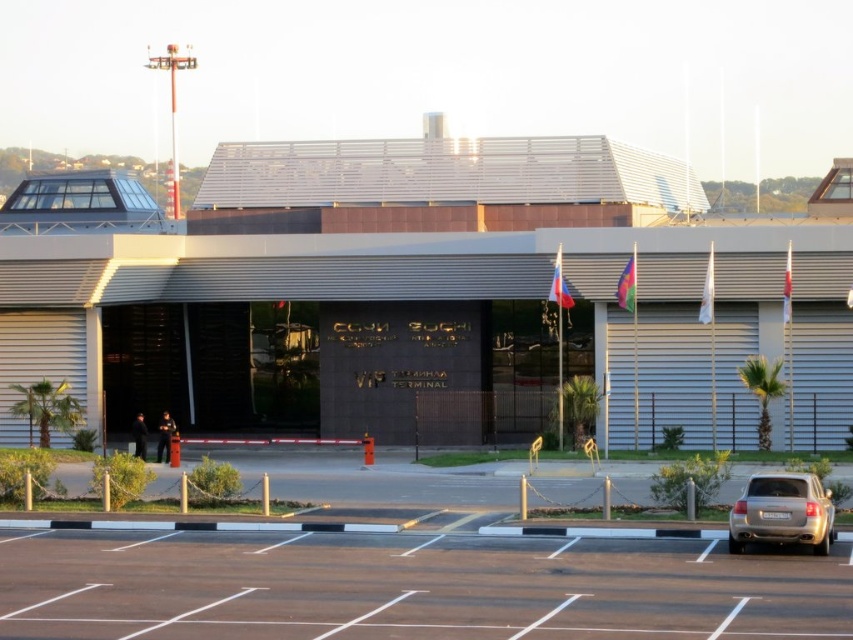
Which of these two, green leafy palm tree at left or green leafy palm tree at right, stands shorter?

Standing shorter between the two is green leafy palm tree at left.

Does green leafy palm tree at left have a lesser width compared to green leafy palm tree at right?

In fact, green leafy palm tree at left might be wider than green leafy palm tree at right.

What do you see at coordinates (47, 408) in the screenshot?
I see `green leafy palm tree at left` at bounding box center [47, 408].

You are a GUI agent. You are given a task and a screenshot of the screen. Output one action in this format:
    pyautogui.click(x=<x>, y=<y>)
    Task: Click on the green leafy palm tree at left
    The width and height of the screenshot is (853, 640).
    Given the screenshot: What is the action you would take?
    pyautogui.click(x=47, y=408)

Can you confirm if silver metallic sedan at lower right is positioned below green leafy palm tree at right?

Yes, silver metallic sedan at lower right is below green leafy palm tree at right.

This screenshot has width=853, height=640. What do you see at coordinates (782, 513) in the screenshot?
I see `silver metallic sedan at lower right` at bounding box center [782, 513].

This screenshot has width=853, height=640. What do you see at coordinates (782, 513) in the screenshot?
I see `silver metallic sedan at lower right` at bounding box center [782, 513].

The image size is (853, 640). In order to click on silver metallic sedan at lower right in this screenshot , I will do `click(782, 513)`.

Does black asphalt parking lot at lower center appear under green leafy palm tree at left?

Correct, black asphalt parking lot at lower center is located below green leafy palm tree at left.

I want to click on black asphalt parking lot at lower center, so click(x=409, y=588).